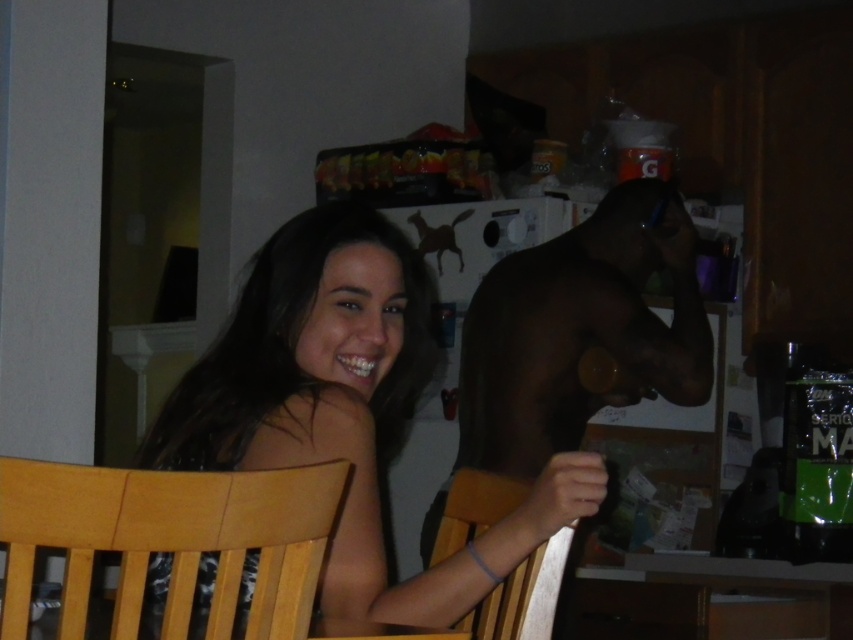
Question: Can you confirm if shiny brown torso at center is smaller than wooden chair at lower center?

Choices:
 (A) yes
 (B) no

Answer: (B)

Question: Which of the following is the farthest from the observer?

Choices:
 (A) smooth skin girl at center
 (B) wooden chair at lower center

Answer: (B)

Question: Considering the real-world distances, which object is farthest from the shiny brown torso at center?

Choices:
 (A) wooden chair at lower left
 (B) smooth skin girl at center
 (C) wooden chair at lower center
 (D) dark brown hair at center

Answer: (A)

Question: Can you confirm if shiny brown torso at center is positioned above dark brown hair at center?

Choices:
 (A) no
 (B) yes

Answer: (A)

Question: Can you confirm if smooth skin girl at center is thinner than wooden chair at lower left?

Choices:
 (A) no
 (B) yes

Answer: (A)

Question: Which of the following is the farthest from the observer?

Choices:
 (A) (476, 625)
 (B) (646, 312)
 (C) (184, 465)
 (D) (213, 410)

Answer: (B)